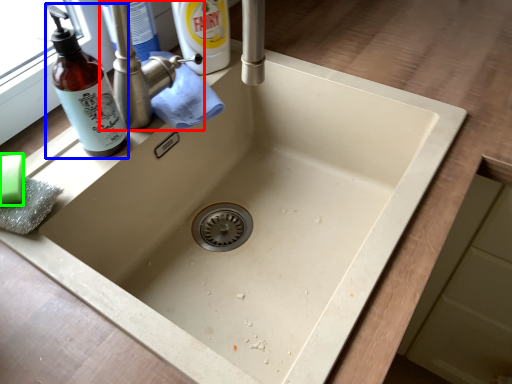
Question: Considering the real-world distances, which object is farthest from tap (highlighted by a red box)? bottle (highlighted by a blue box) or soap (highlighted by a green box)?

Choices:
 (A) bottle
 (B) soap

Answer: (B)